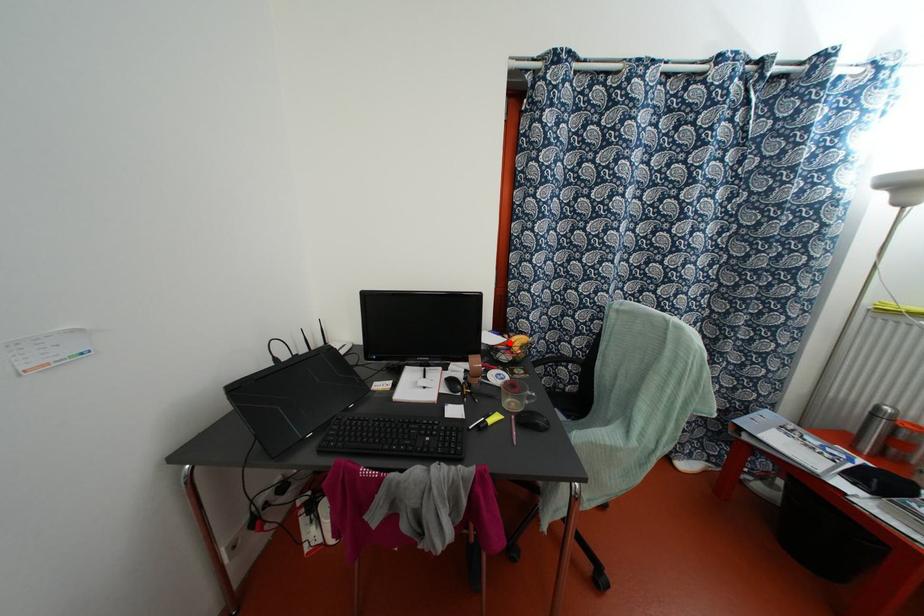
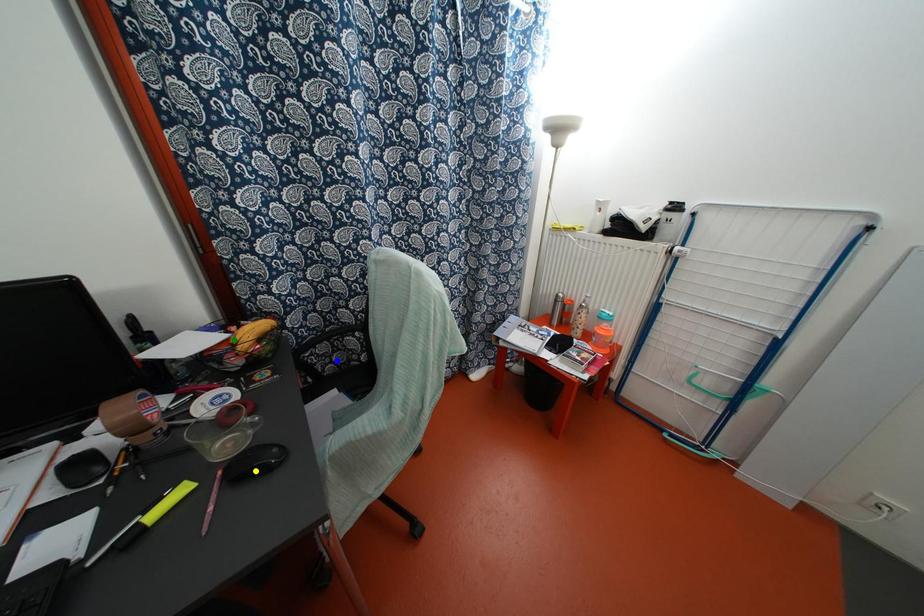
Question: I am providing you with two images of the same scene from different viewpoints. A red point is marked on the first image. You are given multiple points on the second image. In image 2, which mark is for the same physical point as the one in image 1?

Choices:
 (A) green point
 (B) blue point
 (C) yellow point

Answer: (A)